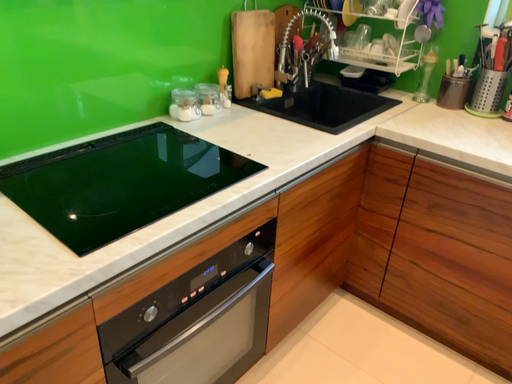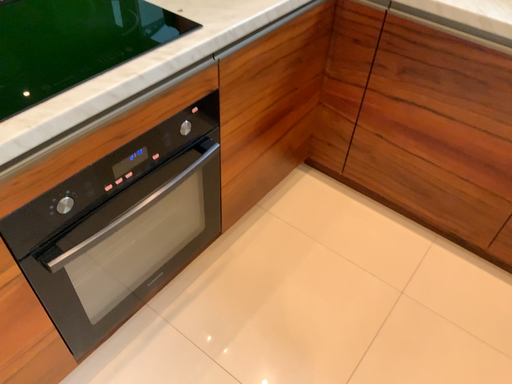
Question: Which way did the camera rotate in the video?

Choices:
 (A) rotated downward
 (B) rotated upward

Answer: (A)